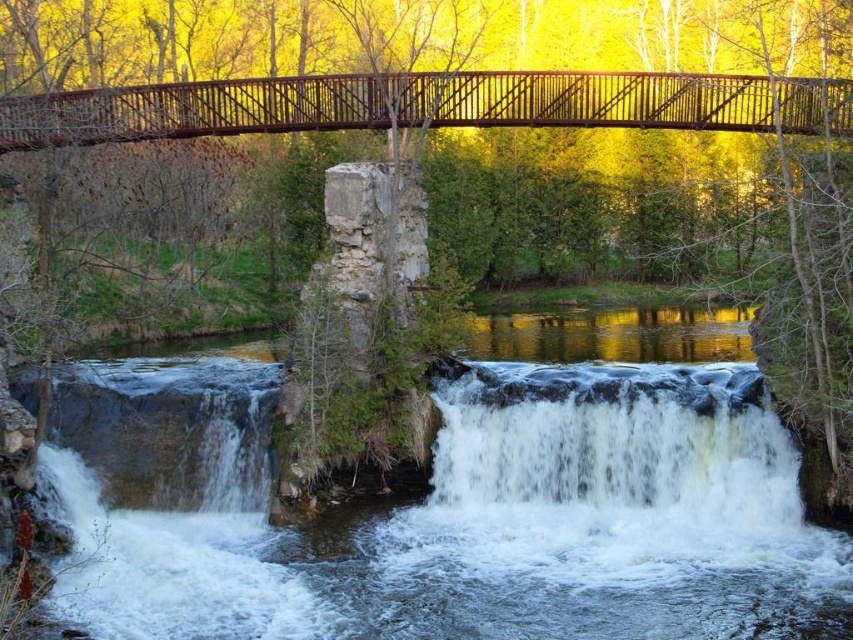
Does smooth stone waterfall at center appear on the right side of rusty metal bridge at upper center?

Incorrect, smooth stone waterfall at center is not on the right side of rusty metal bridge at upper center.

Does point (743, 356) come behind point (578, 120)?

That is True.

What do you see at coordinates (459, 499) in the screenshot? I see `smooth stone waterfall at center` at bounding box center [459, 499].

The width and height of the screenshot is (853, 640). I want to click on smooth stone waterfall at center, so click(x=459, y=499).

Looking at this image, does white frothy water at center appear on the right side of rusty metal bridge at upper center?

Correct, you'll find white frothy water at center to the right of rusty metal bridge at upper center.

Which of these two, white frothy water at center or rusty metal bridge at upper center, stands shorter?

white frothy water at center is shorter.

Does point (611, 400) come in front of point (775, 112)?

No, (611, 400) is behind (775, 112).

Where is `white frothy water at center`? white frothy water at center is located at coordinates (614, 435).

Between smooth stone waterfall at center and white frothy water at center, which one appears on the right side from the viewer's perspective?

white frothy water at center

Image resolution: width=853 pixels, height=640 pixels. I want to click on smooth stone waterfall at center, so click(459, 499).

This screenshot has height=640, width=853. What are the coordinates of `smooth stone waterfall at center` in the screenshot? It's located at (459, 499).